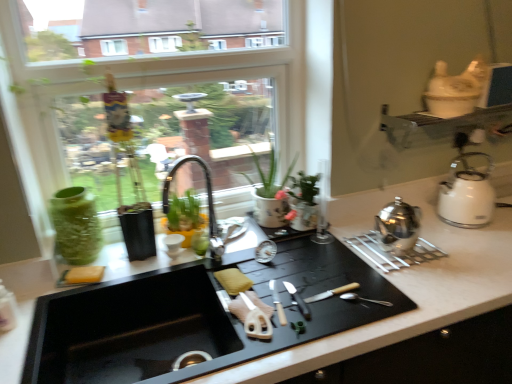
Where is `free spot to the left of satin silver teapot at right, placed as the 2th kitchen appliance when sorted from back to front`? Image resolution: width=512 pixels, height=384 pixels. free spot to the left of satin silver teapot at right, placed as the 2th kitchen appliance when sorted from back to front is located at coordinates (343, 258).